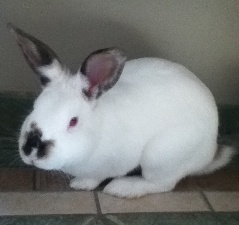
Where is `wall`? This screenshot has width=239, height=225. wall is located at coordinates (192, 34).